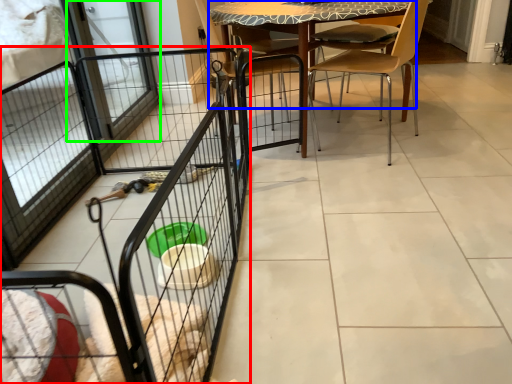
Question: Which is nearer to the cage (highlighted by a red box)? table (highlighted by a blue box) or screen door (highlighted by a green box).

Choices:
 (A) table
 (B) screen door

Answer: (A)